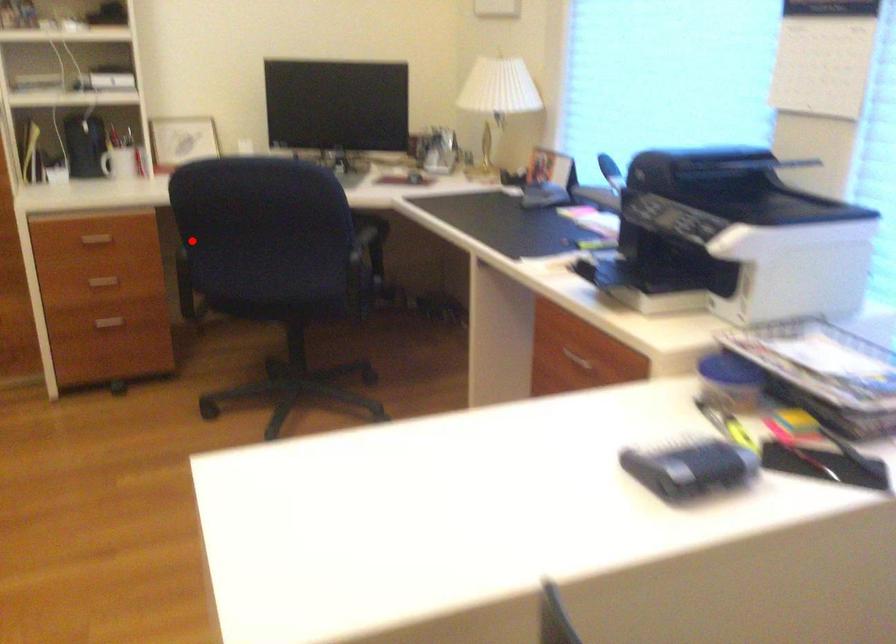
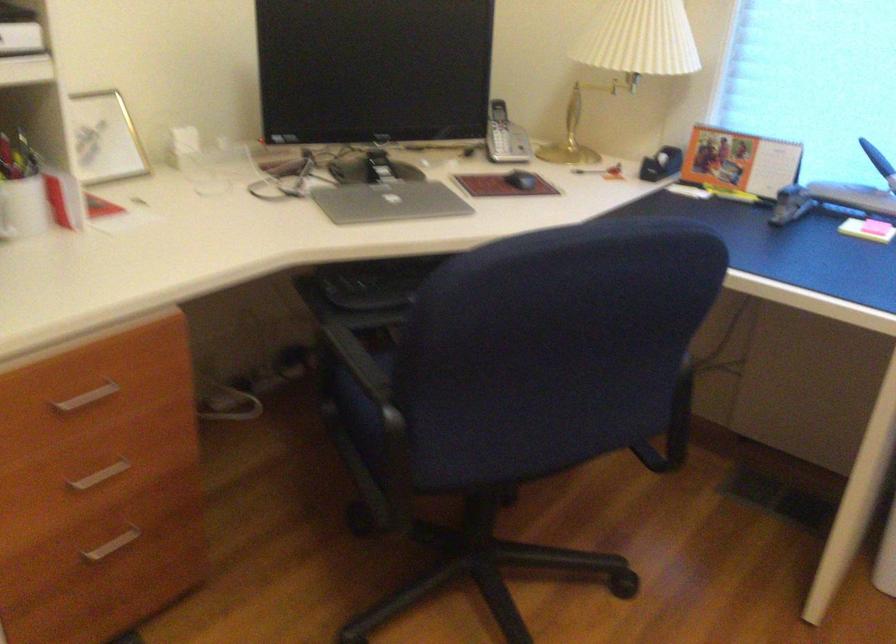
Question: I am providing you with two images of the same scene from different viewpoints. In image1, a red point is highlighted. Considering the same 3D point in image2, which of the following is correct?

Choices:
 (A) It is closer
 (B) It is farther

Answer: (A)